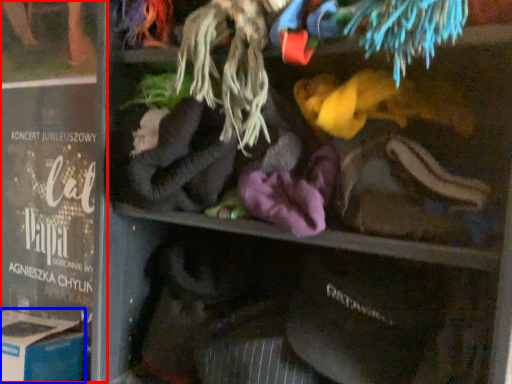
Question: Which object is closer to the camera taking this photo, book (highlighted by a red box) or cardboard box (highlighted by a blue box)?

Choices:
 (A) book
 (B) cardboard box

Answer: (B)